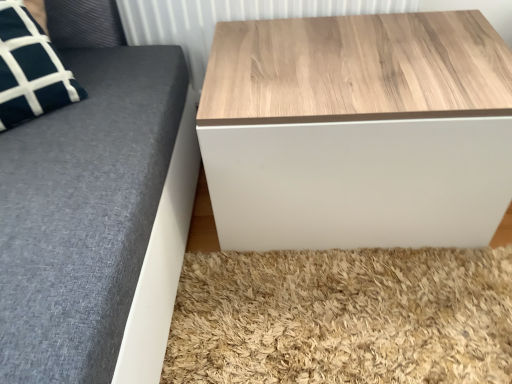
Question: Should I look upward or downward to see wooden/textured table at upper right?

Choices:
 (A) up
 (B) down

Answer: (A)

Question: Is wooden/textured table at upper right to the left of wooden panel at upper center from the viewer's perspective?

Choices:
 (A) no
 (B) yes

Answer: (A)

Question: Does wooden/textured table at upper right have a lesser width compared to wooden panel at upper center?

Choices:
 (A) yes
 (B) no

Answer: (B)

Question: Is wooden/textured table at upper right wider than wooden panel at upper center?

Choices:
 (A) no
 (B) yes

Answer: (B)

Question: From a real-world perspective, is wooden/textured table at upper right under wooden panel at upper center?

Choices:
 (A) no
 (B) yes

Answer: (B)

Question: From the image's perspective, does wooden/textured table at upper right appear lower than wooden panel at upper center?

Choices:
 (A) yes
 (B) no

Answer: (A)

Question: Is wooden/textured table at upper right behind wooden panel at upper center?

Choices:
 (A) yes
 (B) no

Answer: (B)

Question: Is wooden panel at upper center wider than wooden/textured table at upper right?

Choices:
 (A) yes
 (B) no

Answer: (B)

Question: From a real-world perspective, is wooden panel at upper center under wooden/textured table at upper right?

Choices:
 (A) no
 (B) yes

Answer: (A)

Question: Would you consider wooden panel at upper center to be distant from wooden/textured table at upper right?

Choices:
 (A) no
 (B) yes

Answer: (A)

Question: Is the surface of wooden panel at upper center in direct contact with wooden/textured table at upper right?

Choices:
 (A) no
 (B) yes

Answer: (A)

Question: Is wooden panel at upper center turned away from wooden/textured table at upper right?

Choices:
 (A) yes
 (B) no

Answer: (B)

Question: Can we say wooden panel at upper center lies outside wooden/textured table at upper right?

Choices:
 (A) yes
 (B) no

Answer: (A)

Question: From the image's perspective, is wooden panel at upper center positioned above or below wooden/textured table at upper right?

Choices:
 (A) above
 (B) below

Answer: (A)